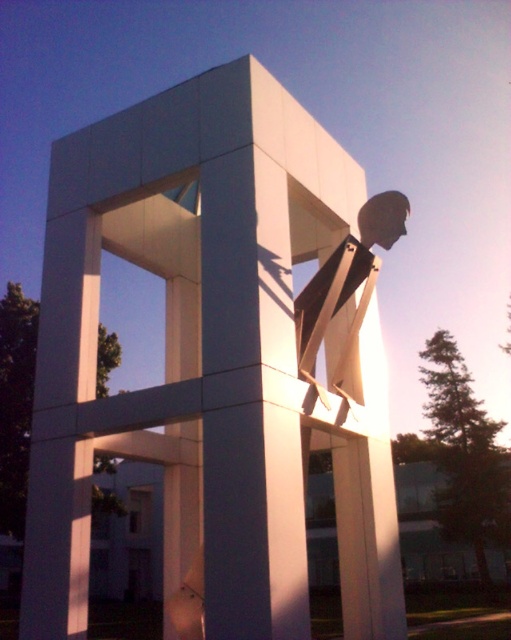
Question: Among these points, which one is nearest to the camera?

Choices:
 (A) (44, 531)
 (B) (361, 248)

Answer: (A)

Question: Can you confirm if white matte sculpture at center is positioned below white matte statue at center?

Choices:
 (A) yes
 (B) no

Answer: (A)

Question: Which of the following is the farthest from the observer?

Choices:
 (A) (307, 561)
 (B) (322, 396)

Answer: (B)

Question: Where is white matte sculpture at center located in relation to white matte statue at center in the image?

Choices:
 (A) below
 (B) above

Answer: (A)

Question: Is white matte sculpture at center bigger than white matte statue at center?

Choices:
 (A) no
 (B) yes

Answer: (B)